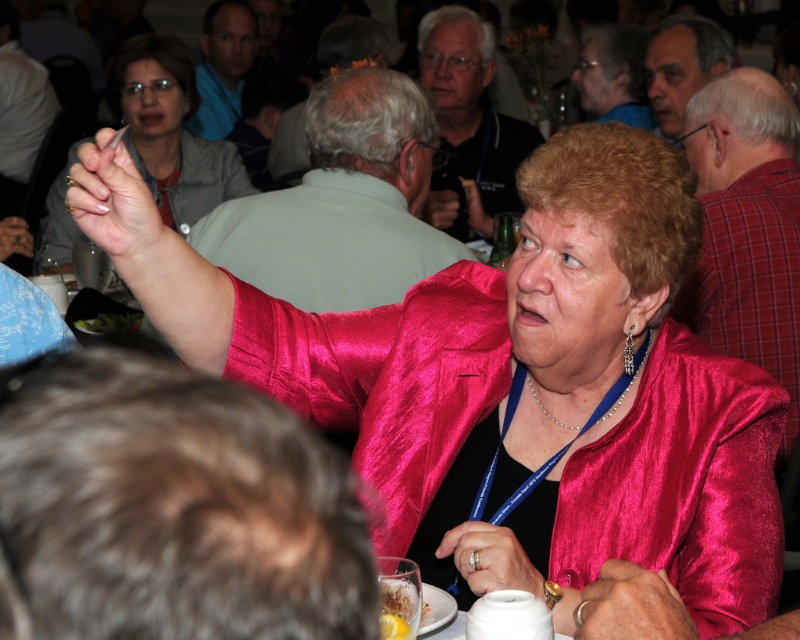
You are a photographer standing at the camera position. You want to take a closeup of the matte black hand at upper left. Is the hand within your camera range if the camera can focus up to 3 meters?

The matte black hand at upper left is 3.52 meters away from the camera, which is beyond the camera focus range of 3 meters. Therefore, the hand is out of focus range.